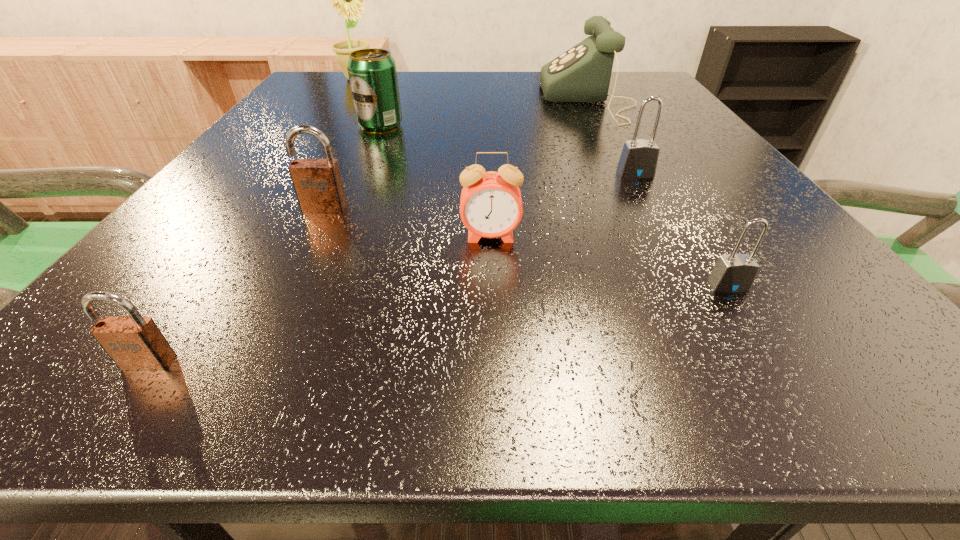
This screenshot has height=540, width=960. I want to click on yellow sunflower, so click(348, 0).

This screenshot has height=540, width=960. I want to click on the tallest object, so click(x=348, y=0).

Where is `telephone`? This screenshot has width=960, height=540. telephone is located at coordinates tap(581, 74).

Where is `green beer can`? The image size is (960, 540). green beer can is located at coordinates (372, 72).

Identify the location of the bigger gray padlock. This screenshot has height=540, width=960. (639, 158).

What are the coordinates of `the fourth farthest object` in the screenshot? It's located at (639, 158).

Find the location of a particular element. This screenshot has height=540, width=960. the third padlock from right to left is located at coordinates (318, 185).

This screenshot has height=540, width=960. I want to click on the farther brown padlock, so click(x=318, y=185).

At what (x,y) coordinates should I click in order to perform the action: click on the sixth farthest object. Please return your answer as a coordinate pair (x, y). Looking at the image, I should click on (490, 205).

In order to click on alarm clock in this screenshot , I will do `click(490, 205)`.